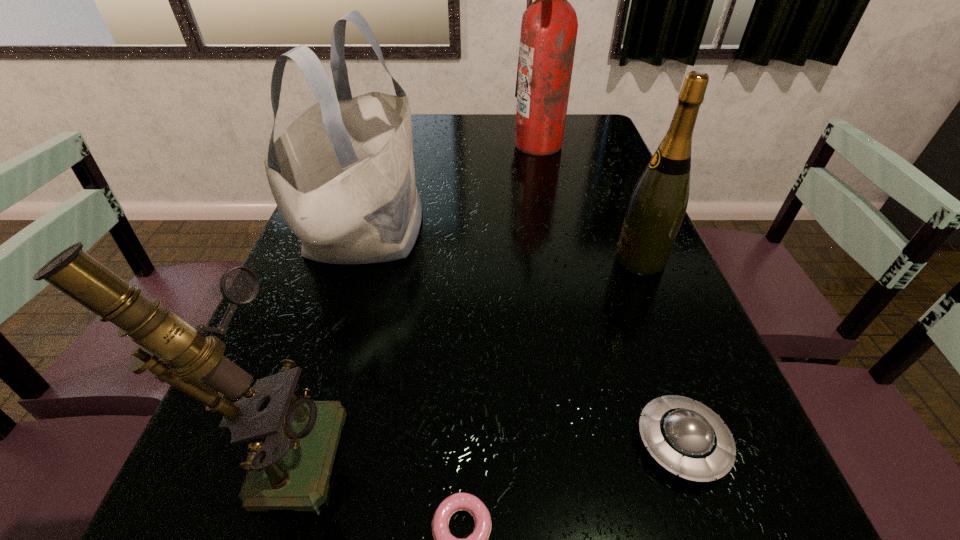
Image resolution: width=960 pixels, height=540 pixels. In order to click on free location at the far edge of the desktop in this screenshot , I will do `click(432, 139)`.

You are a GUI agent. You are given a task and a screenshot of the screen. Output one action in this format:
    pyautogui.click(x=<x>, y=<y>)
    Task: Click on the vacant region at the left edge of the desktop
    
    Given the screenshot: What is the action you would take?
    pyautogui.click(x=278, y=285)

Locate an element on the screen. vacant area at the right edge of the desktop is located at coordinates (580, 161).

The width and height of the screenshot is (960, 540). I want to click on vacant area at the far right corner, so click(565, 122).

Where is `free space between the wine bottle and the shopping bag`? This screenshot has width=960, height=540. free space between the wine bottle and the shopping bag is located at coordinates (503, 245).

Where is `vacant area between the fire extinguisher and the shopping bag`? The width and height of the screenshot is (960, 540). vacant area between the fire extinguisher and the shopping bag is located at coordinates (452, 187).

The image size is (960, 540). Find the location of `vacant space that's between the tallest object and the shopping bag`. vacant space that's between the tallest object and the shopping bag is located at coordinates (452, 187).

Find the location of a particular element. This screenshot has width=960, height=540. free space between the shopping bag and the wine bottle is located at coordinates (503, 245).

Where is `free space between the wine bottle and the fire extinguisher`? The width and height of the screenshot is (960, 540). free space between the wine bottle and the fire extinguisher is located at coordinates (589, 202).

Find the location of `free space between the microscope and the wine bottle`. free space between the microscope and the wine bottle is located at coordinates (457, 352).